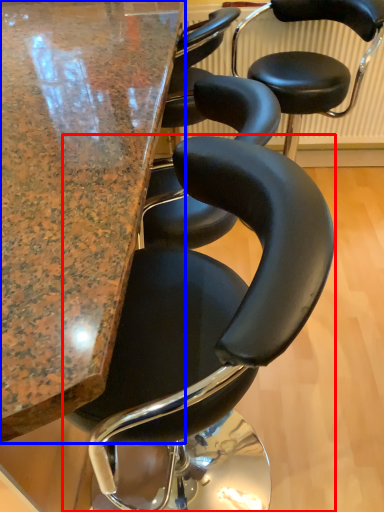
Question: Which object is further to the camera taking this photo, chair (highlighted by a red box) or table (highlighted by a blue box)?

Choices:
 (A) chair
 (B) table

Answer: (A)